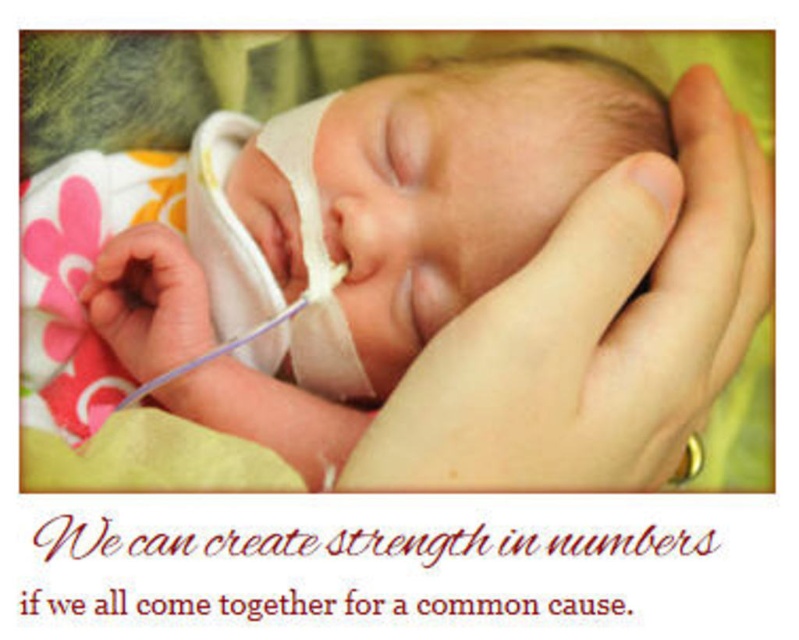
You are a nurse holding a baby in your hands. You notice two points on the baby, one at point (396, 220) and the other at point (678, 468). Which point is closer to you?

Point (396, 220) is closer to the viewer than point (678, 468).

Looking at this image, you are a nurse in the neonatal unit. You need to place the smooth skin newborn at center into an incubator located at coordinate point 0.5, 0.4. Based on the current position of the newborn, will you need to move it horizontally or vertically to reach the incubator?

The smooth skin newborn at center is currently at point (297,257). The incubator is at (319,320). To reach the incubator, you need to move the newborn both horizontally and vertically since both the x and y coordinates differ from the target position.